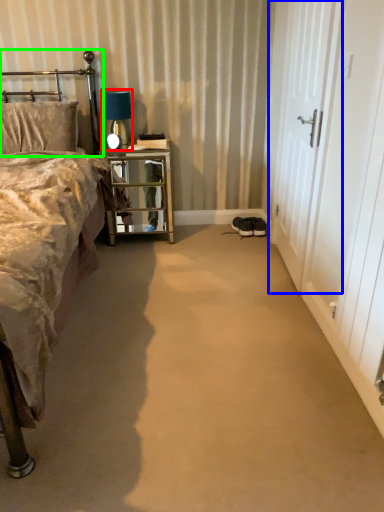
Question: Which object is positioned closest to table lamp (highlighted by a red box)? Select from screen door (highlighted by a blue box) and headboard (highlighted by a green box).

Choices:
 (A) screen door
 (B) headboard

Answer: (B)